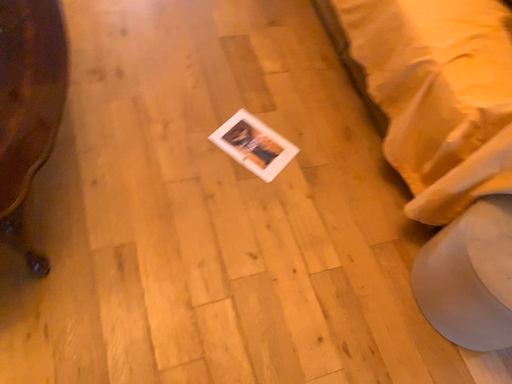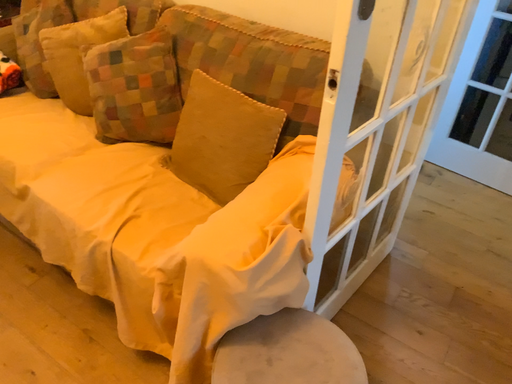
Question: Which way did the camera rotate in the video?

Choices:
 (A) rotated upward
 (B) rotated downward

Answer: (A)